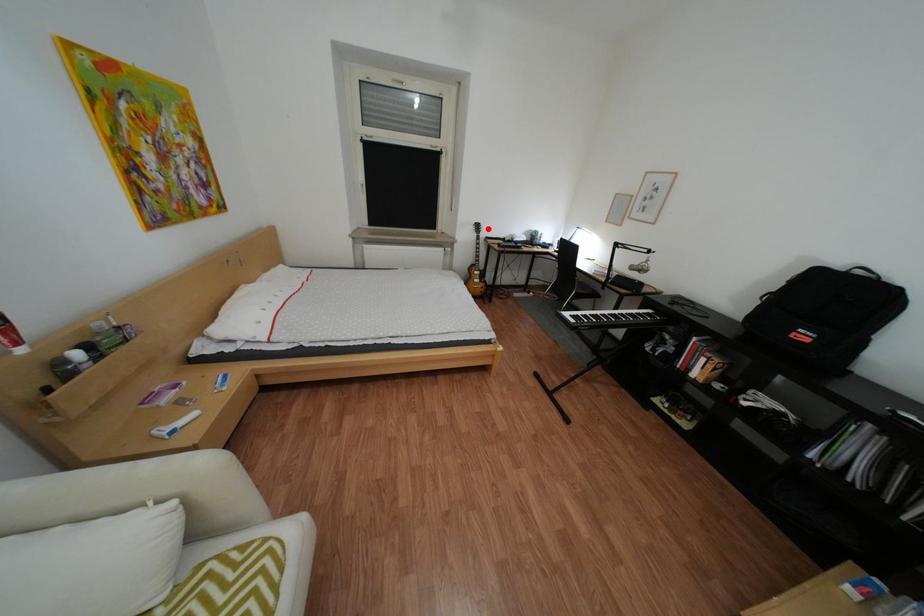
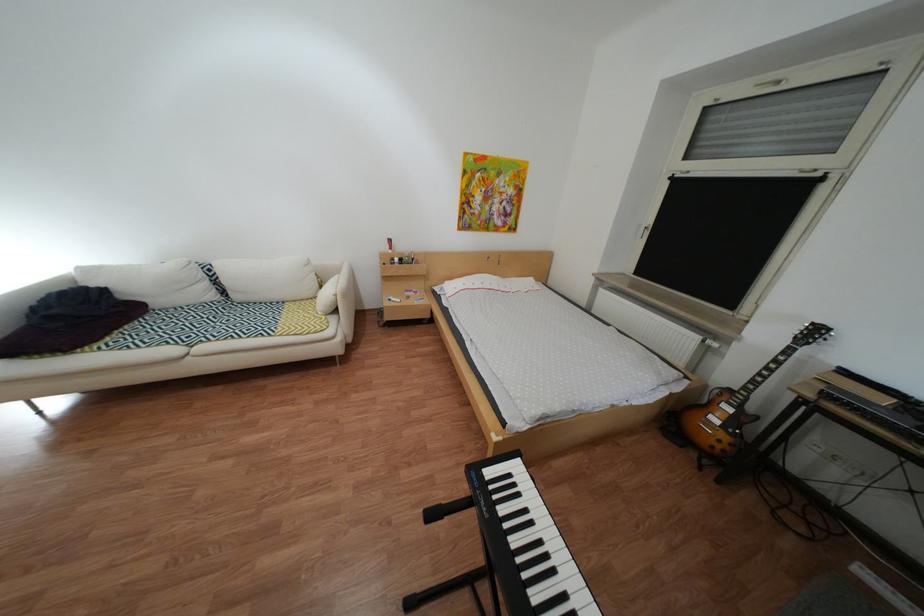
The point at the highlighted location is marked in the first image. Where is the corresponding point in the second image?

(810, 330)